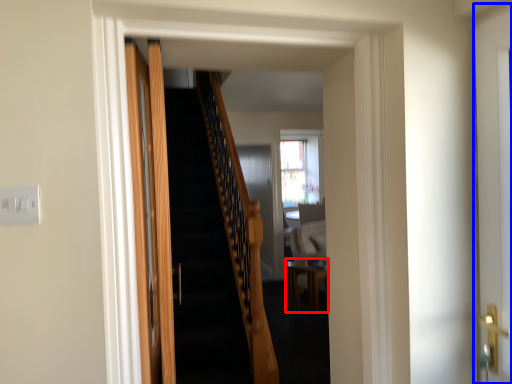
Question: Which object appears farthest to the camera in this image, table (highlighted by a red box) or door (highlighted by a blue box)?

Choices:
 (A) table
 (B) door

Answer: (A)